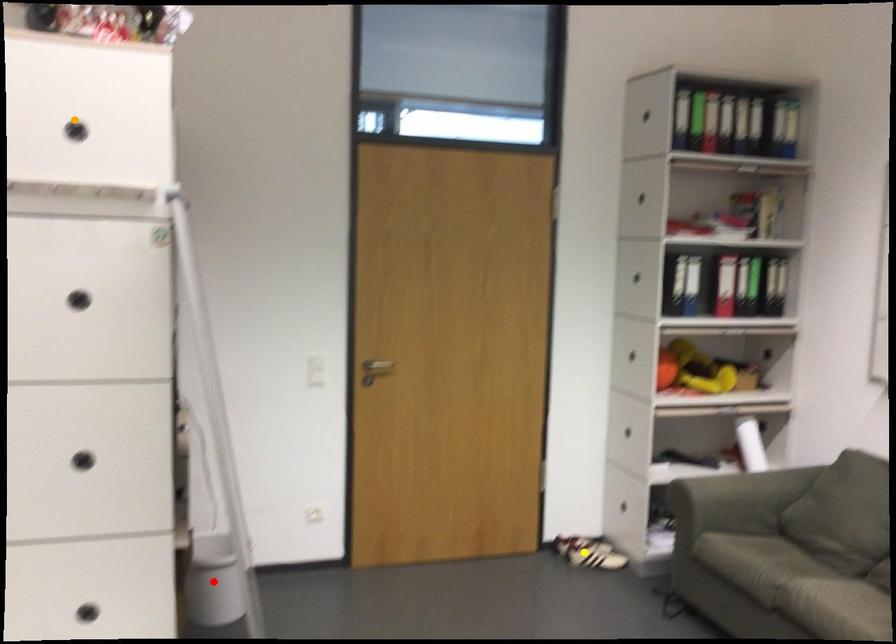
Order these from farthest to nearest:
orange point | yellow point | red point

yellow point < red point < orange point